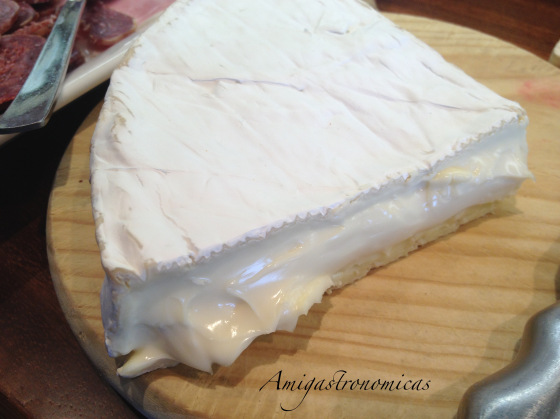
At what (x,y) coordinates should I click in order to perform the action: click on plate. Please return your answer as a coordinate pair (x, y). Looking at the image, I should click on (81, 84).